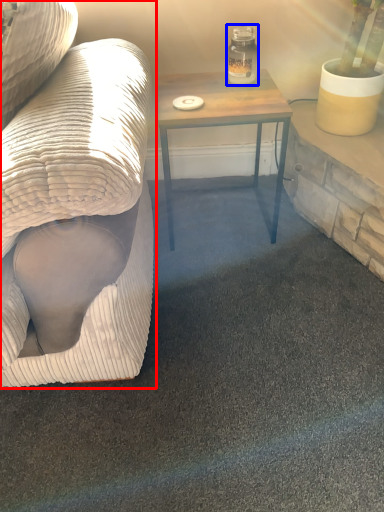
Question: Which object is closer to the camera taking this photo, studio couch (highlighted by a red box) or glass jar (highlighted by a blue box)?

Choices:
 (A) studio couch
 (B) glass jar

Answer: (A)